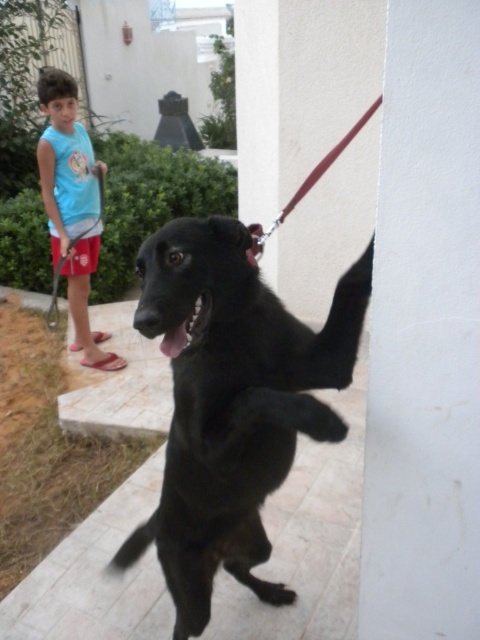
Between white smooth pillar at center and light blue sleeveless shirt at upper left, which one is positioned higher?

Positioned higher is light blue sleeveless shirt at upper left.

Does white smooth pillar at center appear under light blue sleeveless shirt at upper left?

Yes, white smooth pillar at center is below light blue sleeveless shirt at upper left.

Identify the location of white smooth pillar at center. pos(424,333).

Is point (253, 227) more distant than point (99, 182)?

No, (253, 227) is in front of (99, 182).

Can you confirm if red leather leash at upper center is taller than leather-like leash at upper center?

In fact, red leather leash at upper center may be shorter than leather-like leash at upper center.

Where is `red leather leash at upper center`? This screenshot has width=480, height=640. red leather leash at upper center is located at coordinates (305, 186).

The height and width of the screenshot is (640, 480). What do you see at coordinates (231, 403) in the screenshot?
I see `shiny black dog at center` at bounding box center [231, 403].

How far apart are shiny black dog at center and red leather leash at upper center?

They are 23.76 inches apart.

Which is in front, point (292, 369) or point (313, 170)?

Point (292, 369) is in front.

The width and height of the screenshot is (480, 640). In order to click on shiny black dog at center in this screenshot , I will do `click(231, 403)`.